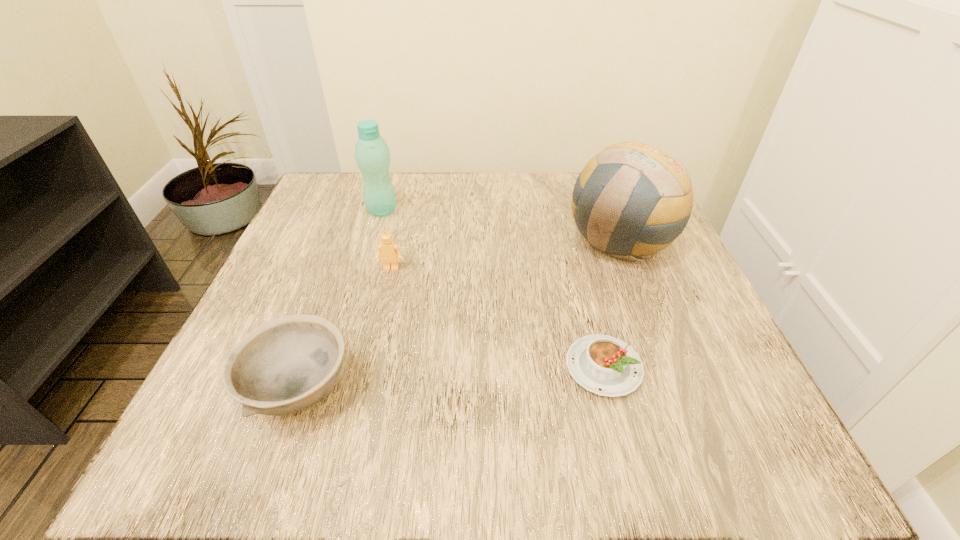
Locate an element on the screen. This screenshot has width=960, height=540. free space between the pudding and the volleyball is located at coordinates (612, 304).

The height and width of the screenshot is (540, 960). Identify the location of unoccupied position between the shortest object and the bottle. (492, 289).

Image resolution: width=960 pixels, height=540 pixels. In order to click on free space that is in between the bowl and the volleyball in this screenshot , I will do `click(460, 315)`.

Locate an element on the screen. The height and width of the screenshot is (540, 960). free point between the bowl and the volleyball is located at coordinates (460, 315).

Where is `vacant area between the shortest object and the bottle`? This screenshot has width=960, height=540. vacant area between the shortest object and the bottle is located at coordinates (492, 289).

Where is `the third closest object to the Lego`? The image size is (960, 540). the third closest object to the Lego is located at coordinates coord(607,366).

The height and width of the screenshot is (540, 960). I want to click on the second closest object relative to the bowl, so click(x=607, y=366).

This screenshot has height=540, width=960. I want to click on blank space that satisfies the following two spatial constraints: 1. on the back side of the bottle; 2. on the right side of the bowl, so click(x=363, y=211).